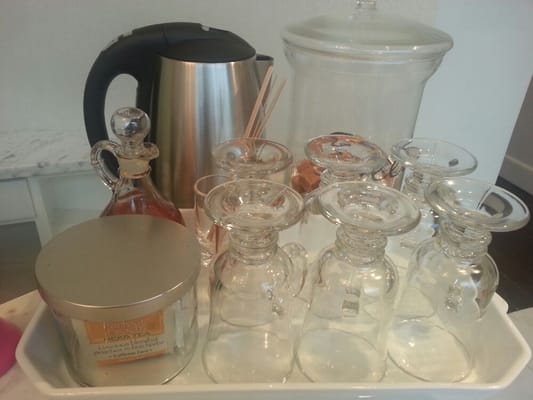
Locate an element on the screen. The image size is (533, 400). glass container is located at coordinates (136, 353).